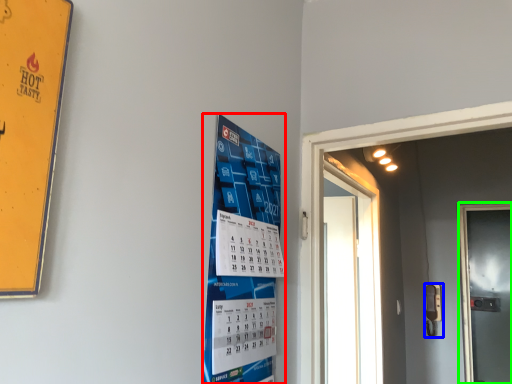
Question: Which object is the farthest from poster (highlighted by a red box)? Choose among these: door handle (highlighted by a blue box) or door (highlighted by a green box).

Choices:
 (A) door handle
 (B) door

Answer: (B)